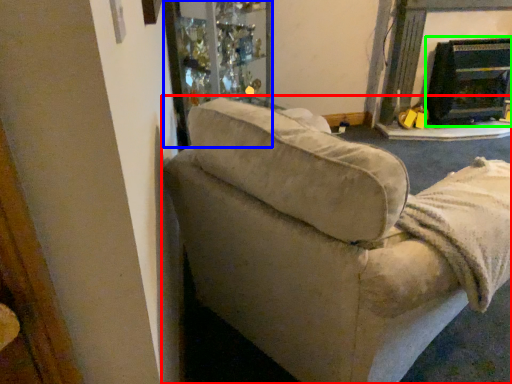
Question: Which object is the closest to the studio couch (highlighted by a red box)? Choose among these: glass door (highlighted by a blue box) or fireplace (highlighted by a green box).

Choices:
 (A) glass door
 (B) fireplace

Answer: (A)